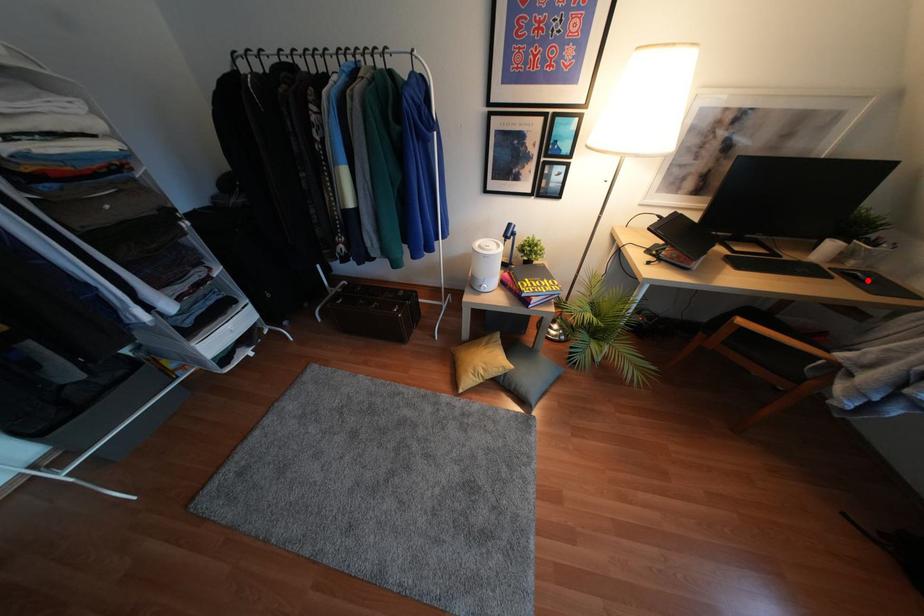
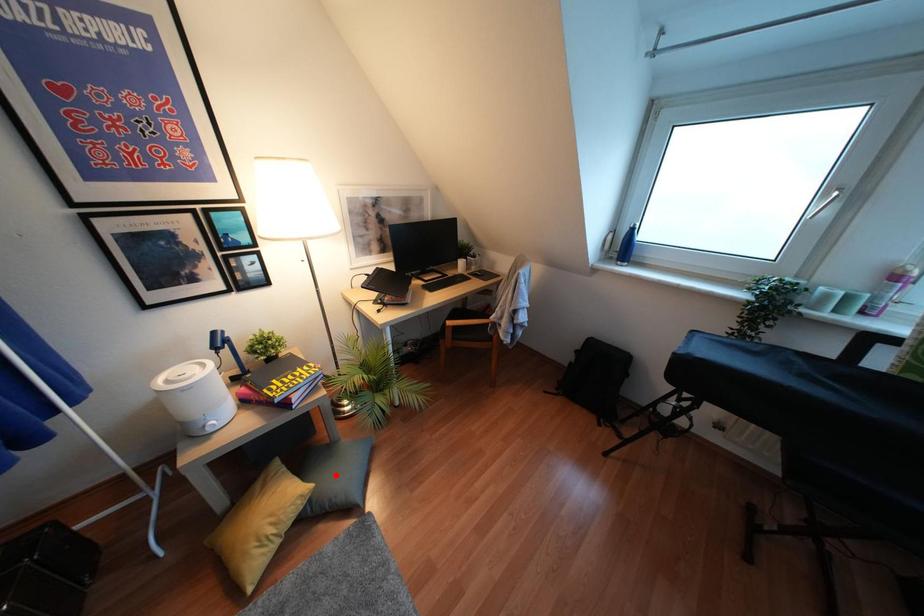
I am providing you with two images of the same scene from different viewpoints. A red point is marked on the first image and another point is marked on the second image. Is the red point in image1 aligned with the point shown in image2?

No